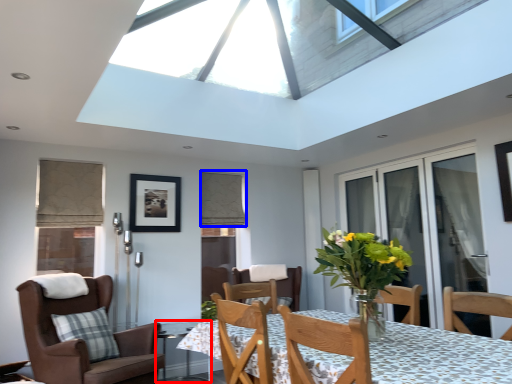
Question: Which point is further to the camera, glass table (highlighted by a red box) or curtain (highlighted by a blue box)?

Choices:
 (A) glass table
 (B) curtain

Answer: (B)